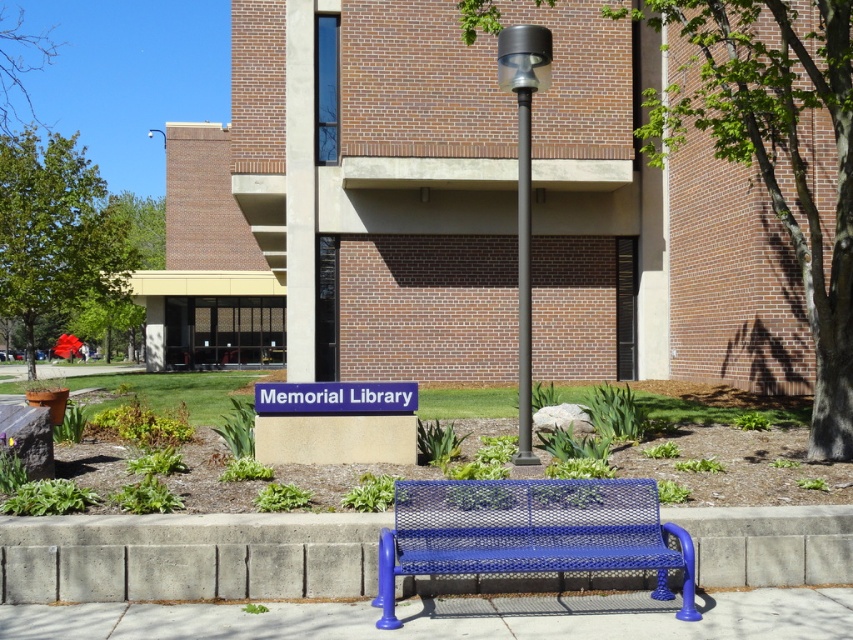
Question: Estimate the real-world distances between objects in this image. Which object is farther from the smooth concrete pavement at lower center?

Choices:
 (A) black metal pole at center
 (B) dark gray metal pole at center

Answer: (B)

Question: Which point is closer to the camera taking this photo?

Choices:
 (A) click(271, 385)
 (B) click(593, 636)
 (C) click(527, 445)

Answer: (B)

Question: Where is black metal pole at center located in relation to dark gray metal pole at center in the image?

Choices:
 (A) left
 (B) right

Answer: (B)

Question: Which object appears closest to the camera in this image?

Choices:
 (A) blue plastic sign at center
 (B) smooth concrete pavement at lower center

Answer: (B)

Question: Is black metal pole at center to the left of blue plastic sign at center from the viewer's perspective?

Choices:
 (A) yes
 (B) no

Answer: (B)

Question: Is smooth concrete pavement at lower center below black metal pole at center?

Choices:
 (A) no
 (B) yes

Answer: (B)